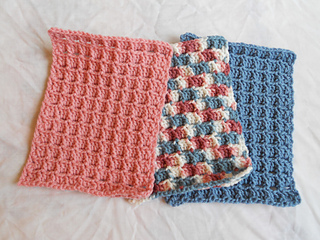
What are the coordinates of `left white bedding` in the screenshot? It's located at (24, 116).